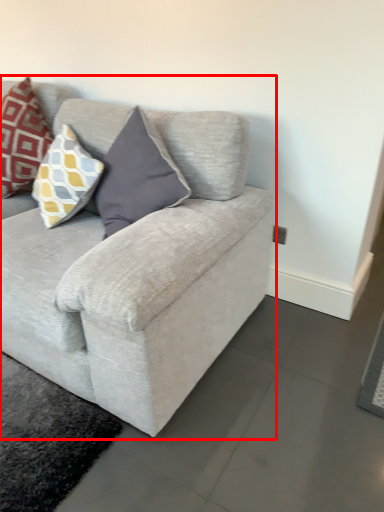
Question: From the image, what is the correct spatial relationship of studio couch (annotated by the red box) in relation to pillow?

Choices:
 (A) left
 (B) right

Answer: (B)